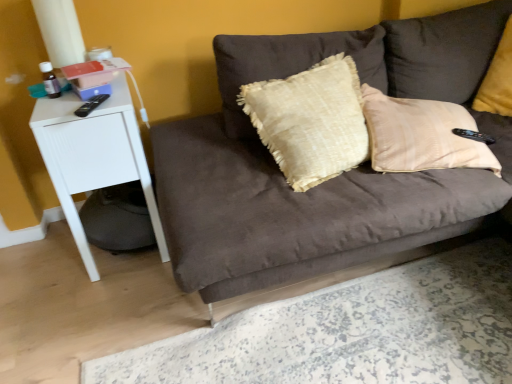
I want to click on free point to the left of white matte side table at left, so click(40, 260).